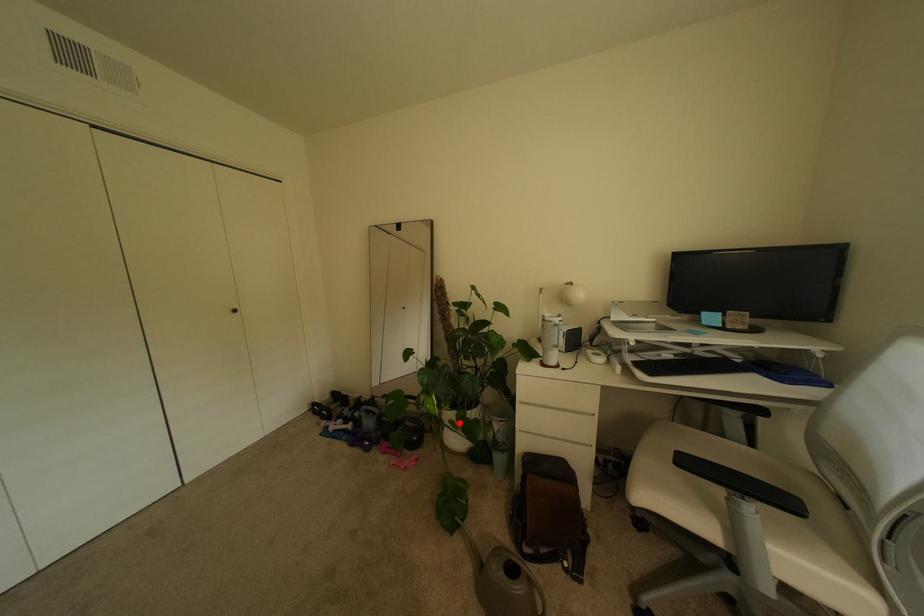
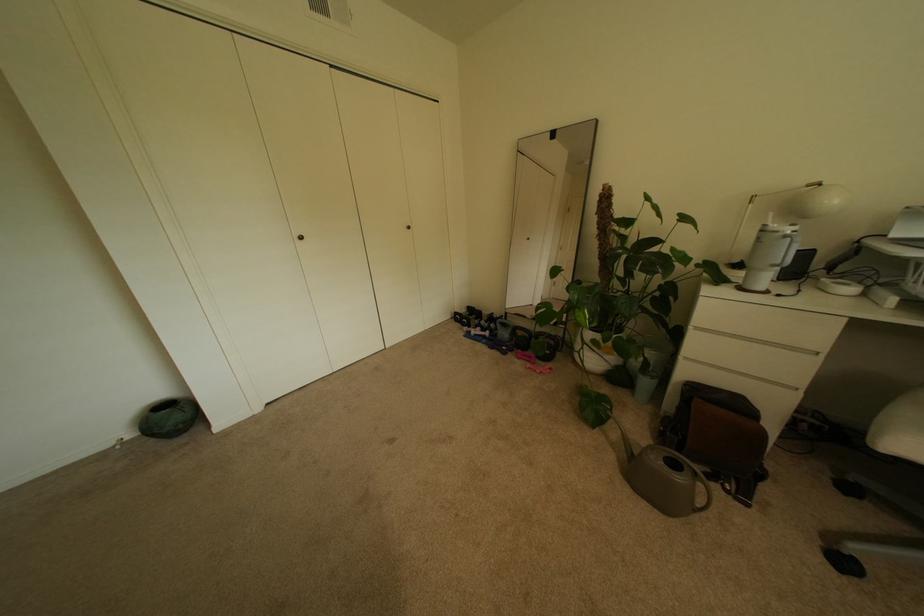
The point at the highlighted location is marked in the first image. Where is the corresponding point in the second image?

(602, 342)